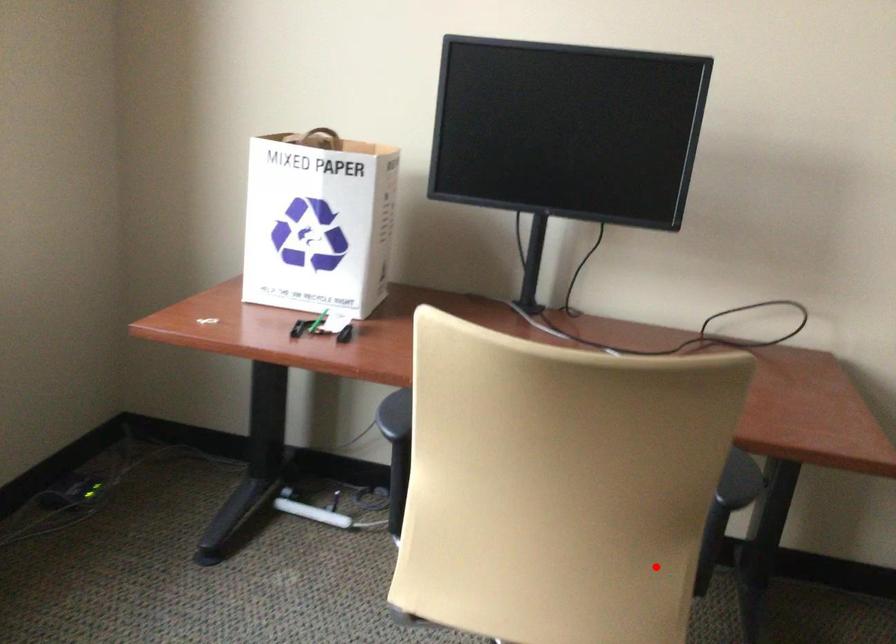
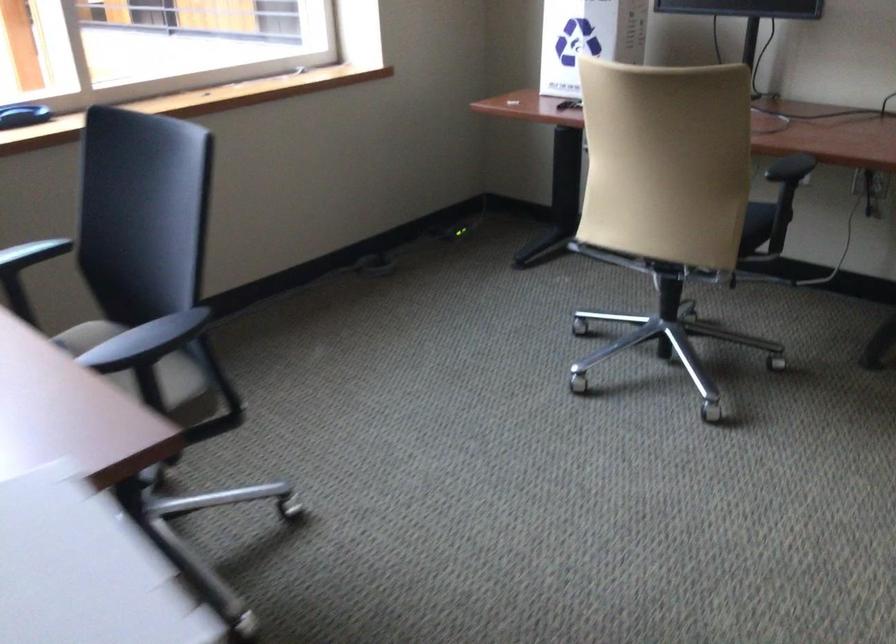
Locate, in the second image, the point that corresponds to the highlighted location in the first image.

(755, 225)